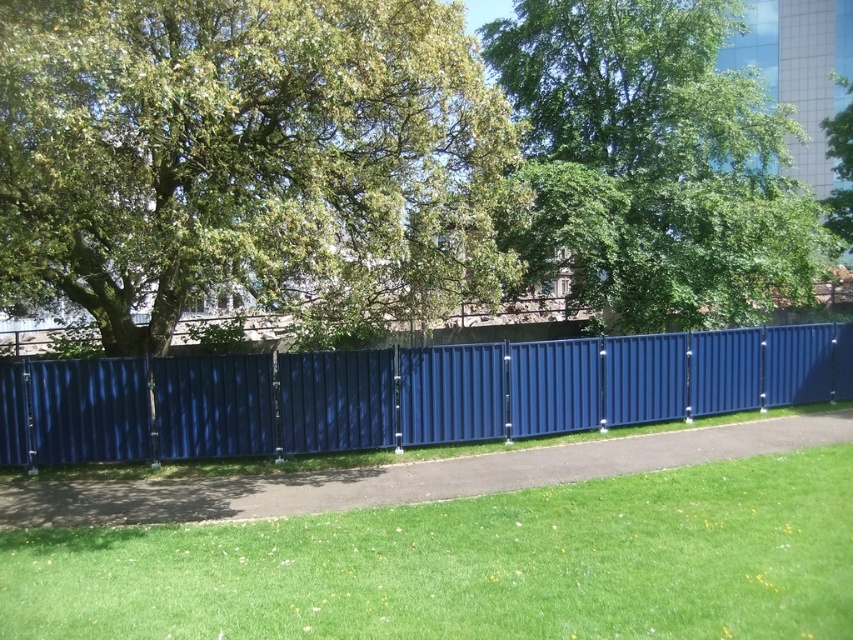
Question: Is green leafy tree at center positioned in front of green leafy tree at upper center?

Choices:
 (A) yes
 (B) no

Answer: (A)

Question: Does green grass at lower center appear over metallic blue fence at center?

Choices:
 (A) yes
 (B) no

Answer: (B)

Question: Is green leafy tree at center thinner than metallic blue fence at center?

Choices:
 (A) yes
 (B) no

Answer: (A)

Question: Estimate the real-world distances between objects in this image. Which object is farther from the green leafy tree at upper right?

Choices:
 (A) green leafy tree at center
 (B) green leafy tree at upper center
 (C) green grass at lower center
 (D) metallic blue fence at center

Answer: (C)

Question: Which point is farther to the camera?

Choices:
 (A) (715, 612)
 (B) (605, 401)

Answer: (B)

Question: Which of the following is the farthest from the observer?

Choices:
 (A) (735, 262)
 (B) (506, 412)
 (C) (849, 188)

Answer: (C)